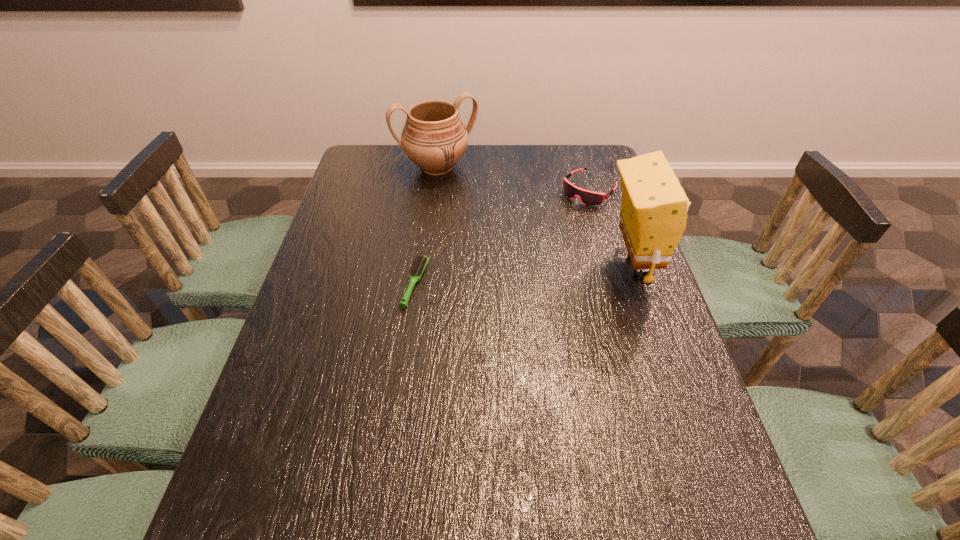
Locate an element on the screen. the shortest object is located at coordinates (420, 262).

Identify the location of the tallest object. (654, 207).

Where is `urn`? Image resolution: width=960 pixels, height=540 pixels. urn is located at coordinates (434, 137).

Where is `goggles`? This screenshot has height=540, width=960. goggles is located at coordinates 589,198.

Locate an element on the screen. This screenshot has width=960, height=540. vacant space situated 0.310m on the back of the hairbrush is located at coordinates (428, 193).

The image size is (960, 540). I want to click on vacant space located on the front-facing side of the urn, so click(483, 240).

What are the coordinates of `free space located 0.140m on the front-facing side of the urn` in the screenshot? It's located at (465, 208).

I want to click on vacant space situated on the front-facing side of the urn, so click(472, 221).

Locate an element on the screen. free space located on the front-facing side of the goggles is located at coordinates (547, 231).

Where is `free space located 0.270m on the front-facing side of the goggles`? free space located 0.270m on the front-facing side of the goggles is located at coordinates (528, 249).